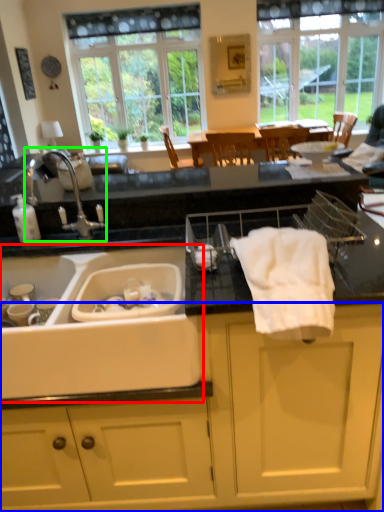
Question: Which object is positioned closest to sink (highlighted by a red box)? Select from cabinetry (highlighted by a blue box) and tap (highlighted by a green box).

Choices:
 (A) cabinetry
 (B) tap

Answer: (A)